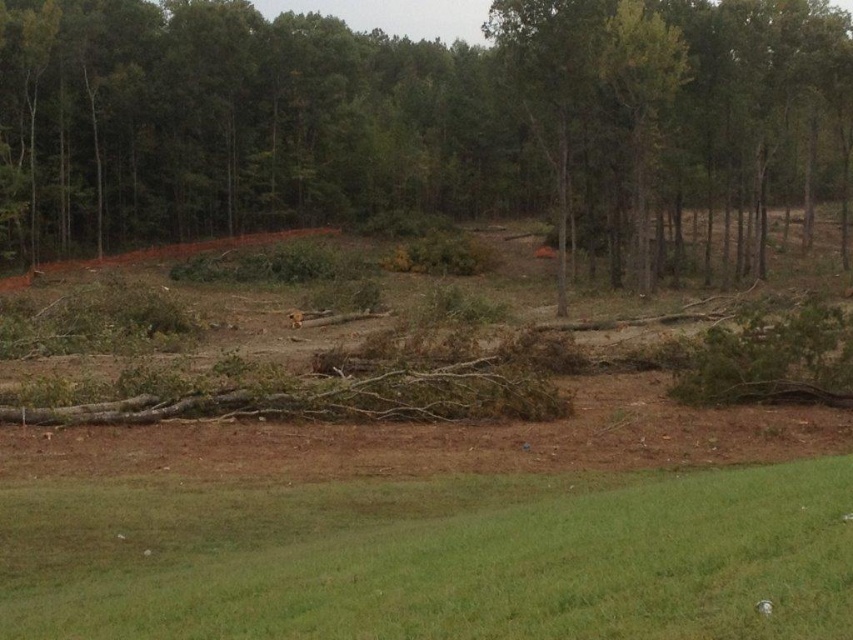
Question: Can you confirm if brown wood log at center is thinner than green grass at lower center?

Choices:
 (A) yes
 (B) no

Answer: (B)

Question: Can you confirm if brown wood log at center is smaller than green grass at lower center?

Choices:
 (A) yes
 (B) no

Answer: (B)

Question: Can you confirm if brown wood log at center is positioned to the left of green grass at lower center?

Choices:
 (A) no
 (B) yes

Answer: (B)